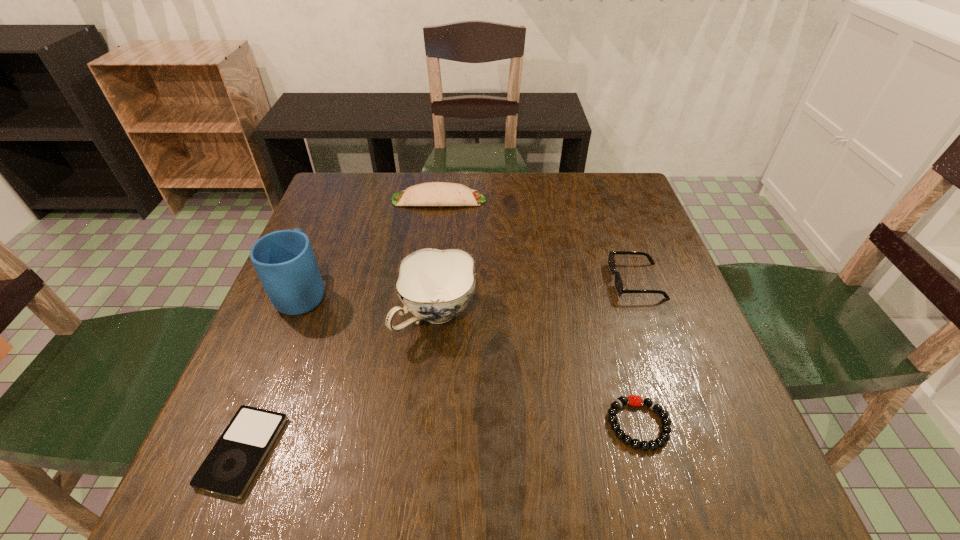
Where is `free space that satisfies the following two spatial constraints: 1. at the bitten end of the burrito; 2. on the left side of the chinaware`? free space that satisfies the following two spatial constraints: 1. at the bitten end of the burrito; 2. on the left side of the chinaware is located at coordinates (425, 316).

What are the coordinates of `vacant space that satisfies the following two spatial constraints: 1. on the back side of the second shortest object; 2. on the left side of the iPod` in the screenshot? It's located at (253, 424).

Find the location of a particular element. The image size is (960, 540). vacant region that satisfies the following two spatial constraints: 1. at the bitten end of the second tallest object; 2. on the right side of the farthest object is located at coordinates (425, 316).

I want to click on vacant space that satisfies the following two spatial constraints: 1. on the front side of the chinaware; 2. on the right side of the fifth tallest object, so click(x=426, y=424).

At what (x,y) coordinates should I click in order to perform the action: click on vacant space that satisfies the following two spatial constraints: 1. on the back side of the fifth shortest object; 2. at the bitten end of the farthest object. Please return your answer as a coordinate pair (x, y). The image size is (960, 540). Looking at the image, I should click on (447, 200).